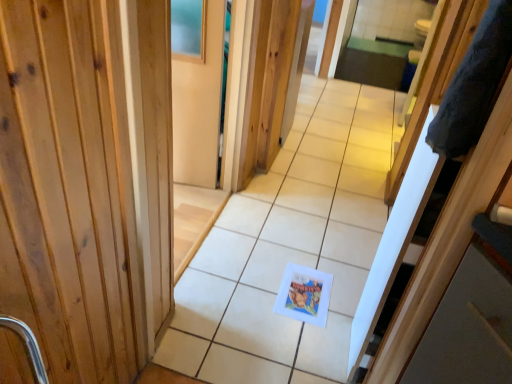
Question: Is gray fluffy robe at right in front of white matte postcard at center?

Choices:
 (A) no
 (B) yes

Answer: (B)

Question: Considering the relative sizes of gray fluffy robe at right and white matte postcard at center in the image provided, is gray fluffy robe at right taller than white matte postcard at center?

Choices:
 (A) yes
 (B) no

Answer: (A)

Question: From the image's perspective, does gray fluffy robe at right appear higher than white matte postcard at center?

Choices:
 (A) no
 (B) yes

Answer: (B)

Question: From a real-world perspective, is gray fluffy robe at right positioned over white matte postcard at center based on gravity?

Choices:
 (A) yes
 (B) no

Answer: (A)

Question: Can you confirm if gray fluffy robe at right is smaller than white matte postcard at center?

Choices:
 (A) yes
 (B) no

Answer: (B)

Question: Could you tell me if gray fluffy robe at right is turned towards white matte postcard at center?

Choices:
 (A) yes
 (B) no

Answer: (B)

Question: From the image's perspective, is gray fluffy robe at right beneath white paper at center?

Choices:
 (A) yes
 (B) no

Answer: (B)

Question: Are gray fluffy robe at right and white paper at center far apart?

Choices:
 (A) yes
 (B) no

Answer: (A)

Question: From a real-world perspective, is gray fluffy robe at right physically above white paper at center?

Choices:
 (A) no
 (B) yes

Answer: (B)

Question: Does gray fluffy robe at right have a larger size compared to white paper at center?

Choices:
 (A) no
 (B) yes

Answer: (A)

Question: Is gray fluffy robe at right with white paper at center?

Choices:
 (A) no
 (B) yes

Answer: (A)

Question: From the image's perspective, is gray fluffy robe at right located above white paper at center?

Choices:
 (A) no
 (B) yes

Answer: (B)

Question: Is there a large distance between gray fluffy robe at right and matte wood screen door at upper center?

Choices:
 (A) yes
 (B) no

Answer: (A)